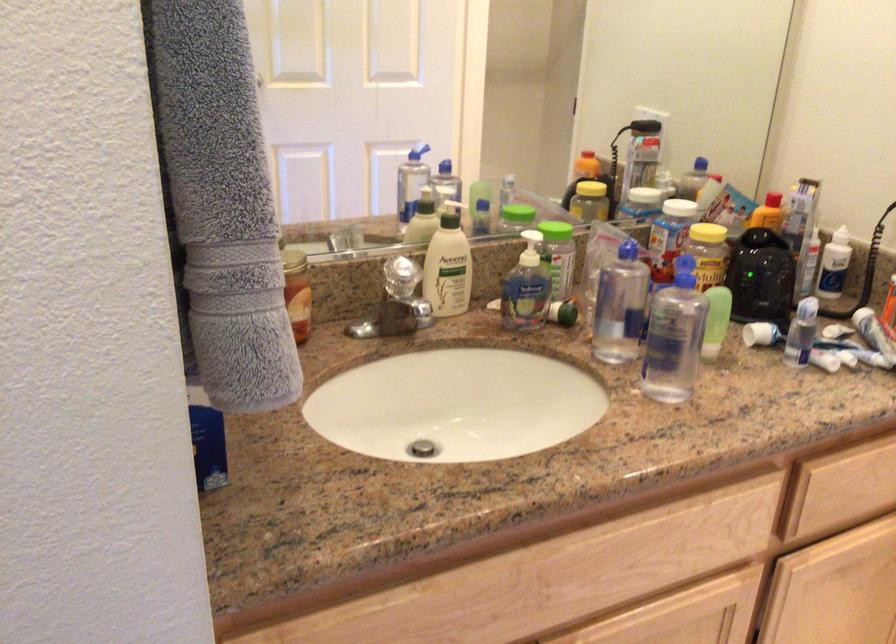
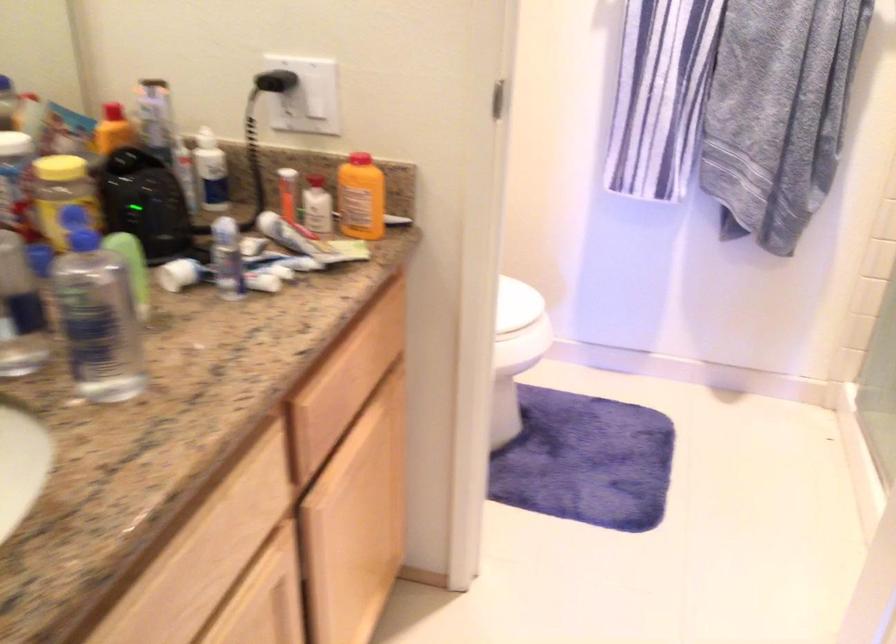
Question: The camera is either moving clockwise (left) or counter-clockwise (right) around the object. The first image is from the beginning of the video and the second image is from the end. Is the camera moving left or right when shooting the video?

Choices:
 (A) Left
 (B) Right

Answer: (A)